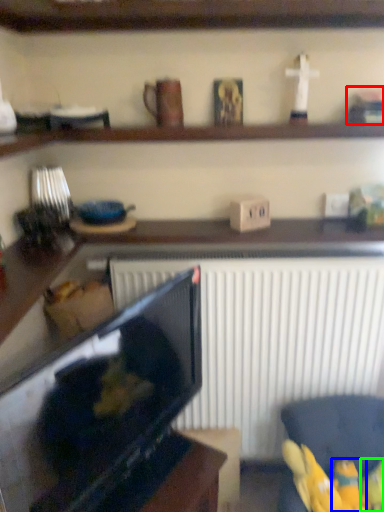
Question: Which object is the closest to the toy (highlighted by a red box)? Choose among these: toy (highlighted by a blue box) or toy (highlighted by a green box).

Choices:
 (A) toy
 (B) toy

Answer: (A)